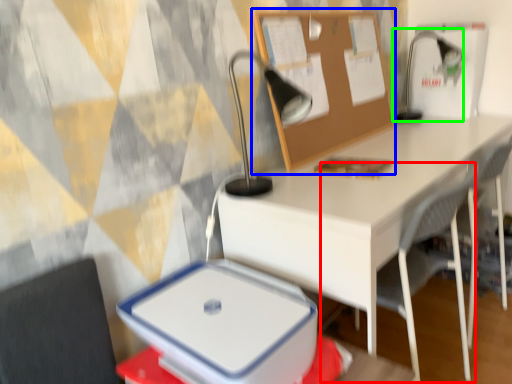
Question: Based on their relative distances, which object is nearer to armchair (highlighted by a red box)? Choose from bulletin board (highlighted by a blue box) and table lamp (highlighted by a green box).

Choices:
 (A) bulletin board
 (B) table lamp

Answer: (A)